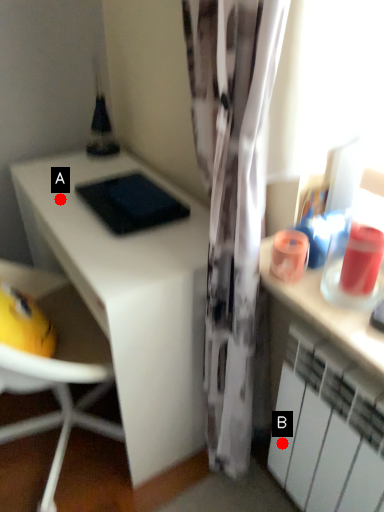
Question: Two points are circled on the image, labeled by A and B beside each circle. Which point appears closest to the camera in this image?

Choices:
 (A) A is closer
 (B) B is closer

Answer: (B)